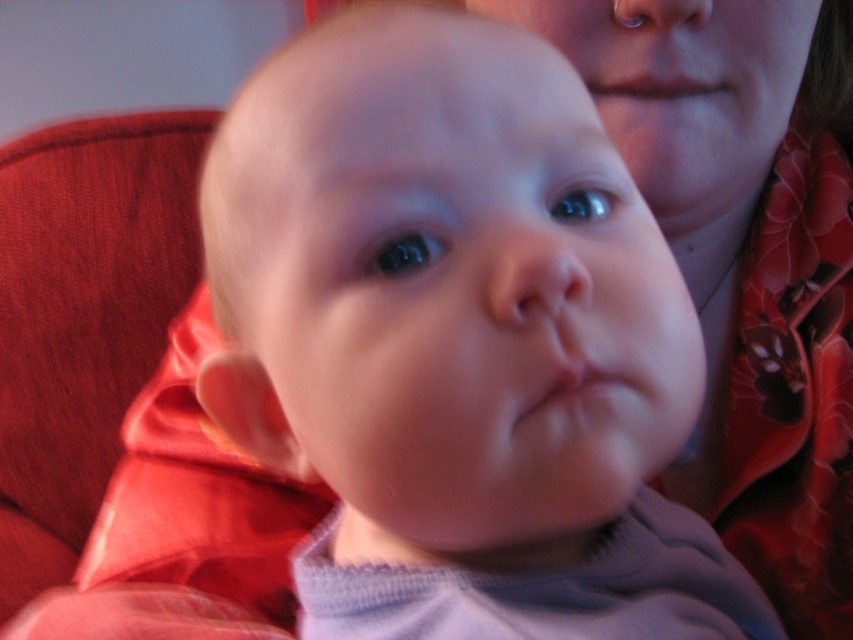
Based on the scene described, which object is larger in size between the pink smooth lips at center and the smooth skin nose at upper center?

The pink smooth lips at center are larger in size compared to the smooth skin nose at upper center.

Looking at the baby in the image, which object is positioned to the left of the other between the pink smooth lips at center and the smooth skin nose at upper center?

The pink smooth lips at center are to the left of the smooth skin nose at upper center.

You are a photographer trying to capture a close portrait of a baby. You are currently positioned at a distance where the baby fills the frame. The baby is at point (527, 237). If you want to ensure the baby remains in focus while adjusting your position, what is the minimum distance you should maintain from the baby?

The minimum distance you should maintain from the baby is 10.77 inches, as that is the distance between the camera and point (527, 237) where the baby is located to keep it in focus.